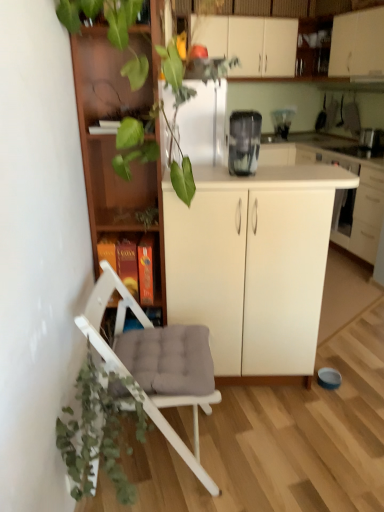
Question: From the image's perspective, relative to metallic silver toaster at upper right, the 2th appliance when ordered from back to front, is white padded chair at lower left above or below?

Choices:
 (A) above
 (B) below

Answer: (B)

Question: Is white padded chair at lower left taller or shorter than metallic silver toaster at upper right, the second appliance positioned from the bottom?

Choices:
 (A) tall
 (B) short

Answer: (A)

Question: Which object is the farthest from the white matte cabinet at center, the 3th cabinetry when ordered from right to left?

Choices:
 (A) white padded chair at lower left
 (B) green matte plant at lower left
 (C) transparent plastic blender at upper center, placed as the first appliance when sorted from back to front
 (D) green leafy plant at upper center
 (E) white glossy cabinet at upper right, which is the 1th cabinetry in top-to-bottom order

Answer: (C)

Question: Estimate the real-world distances between objects in this image. Which object is closer to the green matte plant at lower left?

Choices:
 (A) green leafy plant at upper center
 (B) white glossy cabinet at upper right, arranged as the second cabinetry when viewed from the left
 (C) white matte cabinet at center, which is the first cabinetry from bottom to top
 (D) white padded chair at lower left
 (E) metallic silver toaster at upper right, the 1th appliance in the right-to-left sequence

Answer: (D)